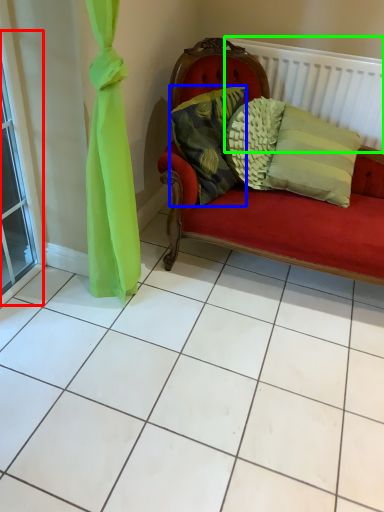
Question: Which object is positioned closest to window (highlighted by a red box)? Select from pillow (highlighted by a blue box) and balustrade (highlighted by a green box).

Choices:
 (A) pillow
 (B) balustrade

Answer: (A)